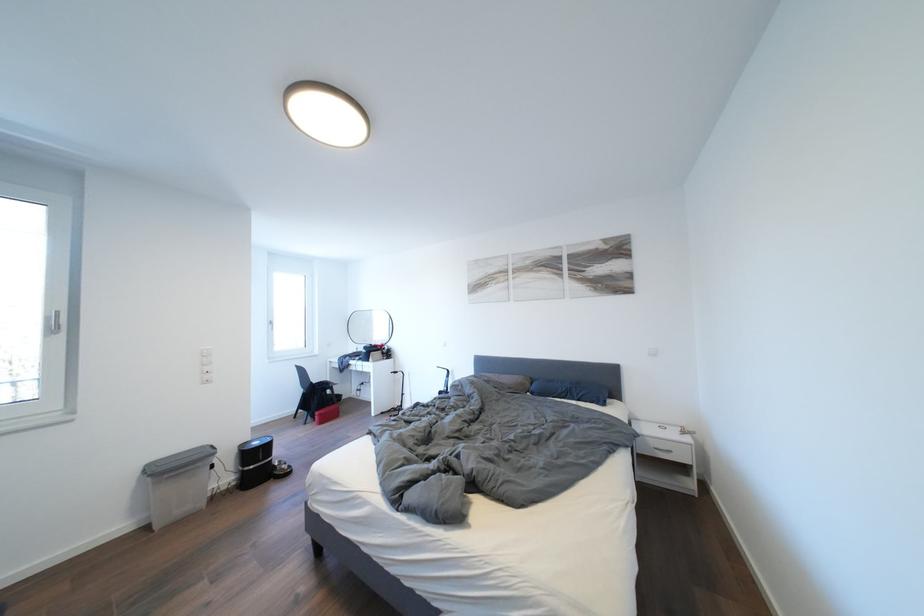
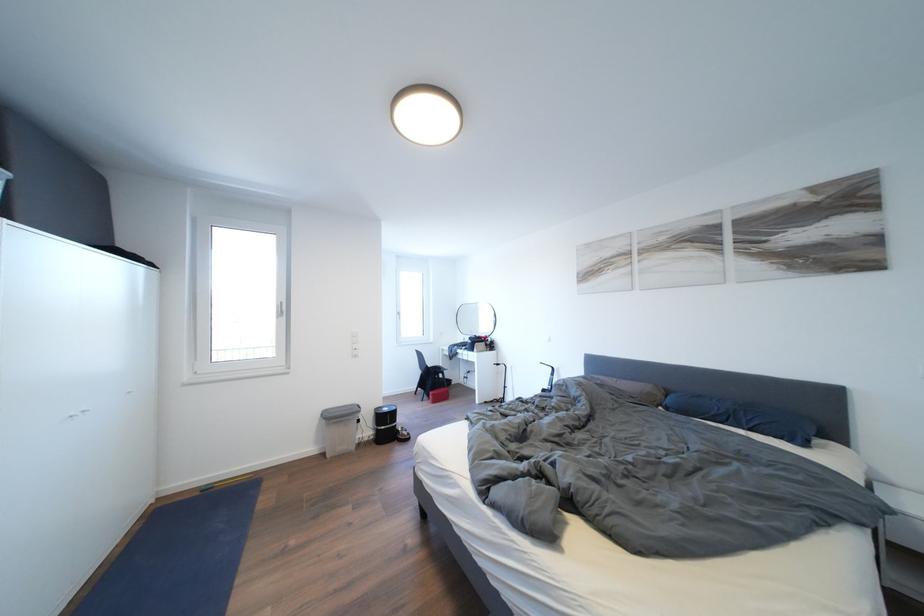
Which direction would the cameraman need to move to produce the second image?

The cameraman walked toward right, forward.